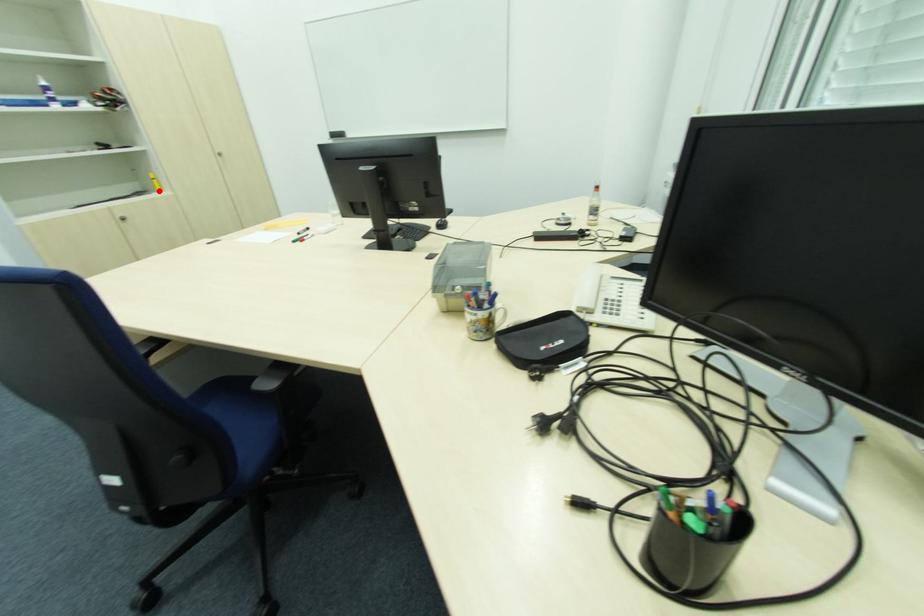
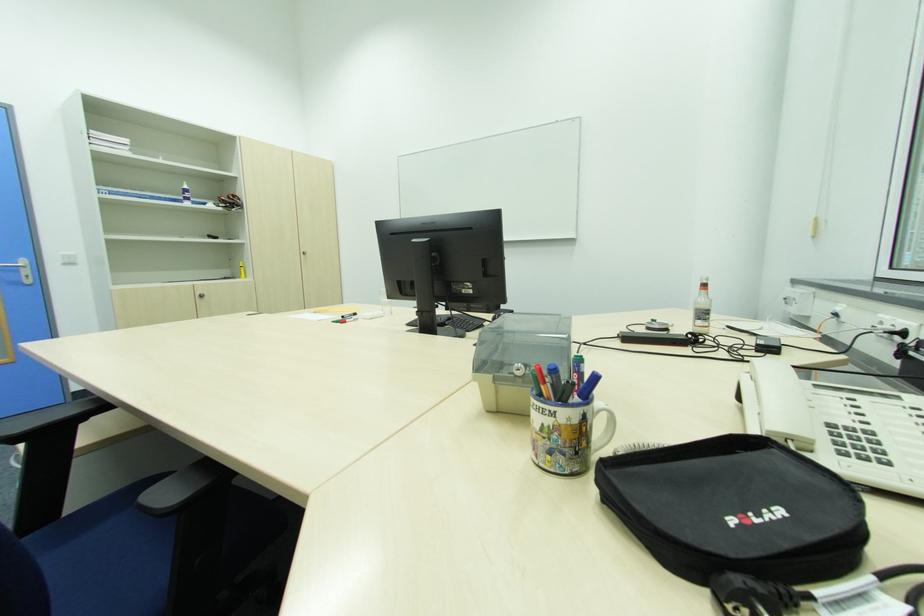
Where in the second image is the point corresponding to the highlighted location from the first image?

(244, 277)